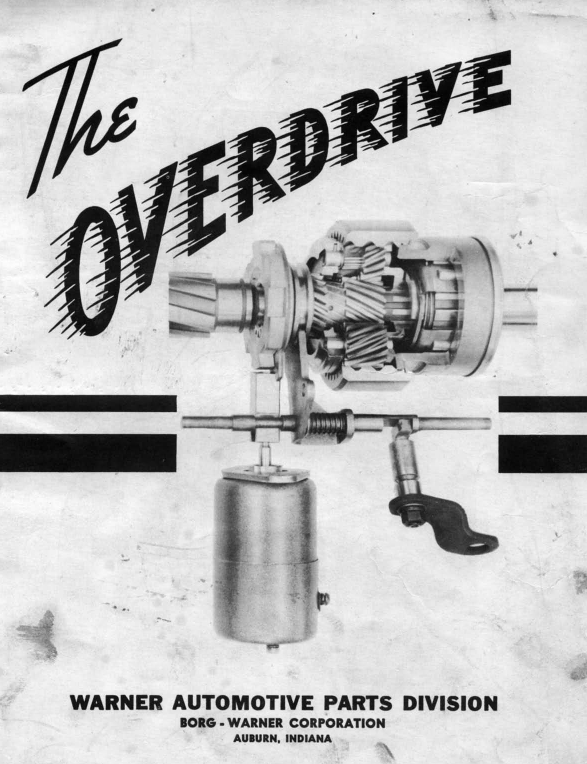
Where is `handle`? handle is located at coordinates (454, 526).